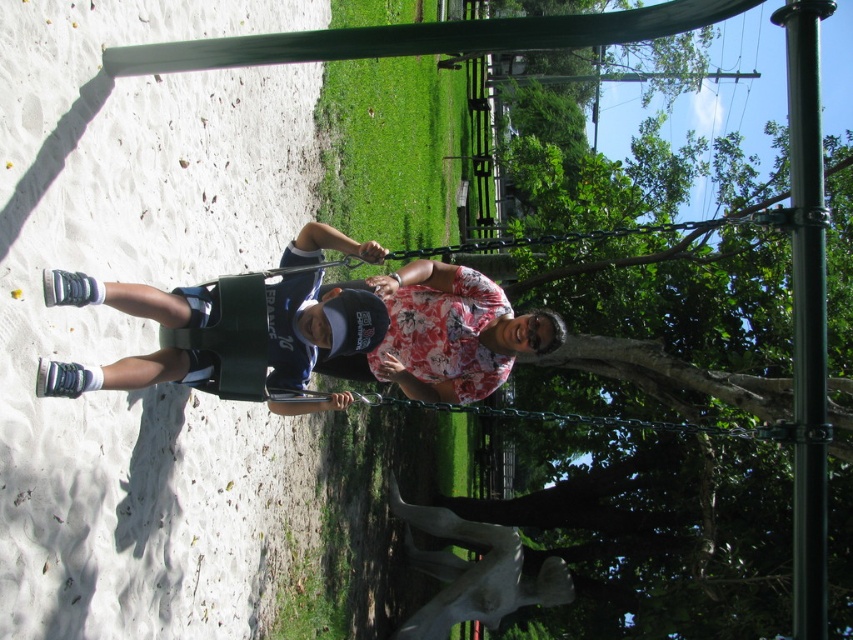
In the scene shown: Who is shorter, matte green wheelchair at left or green metallic pole at right?

Standing shorter between the two is matte green wheelchair at left.

Measure the distance between point (59, 278) and camera.

A distance of 3.69 meters exists between point (59, 278) and camera.

Describe the element at coordinates (316, 326) in the screenshot. This screenshot has height=640, width=853. I see `matte green wheelchair at left` at that location.

Find the location of a particular element. This screenshot has width=853, height=640. matte green wheelchair at left is located at coordinates (316, 326).